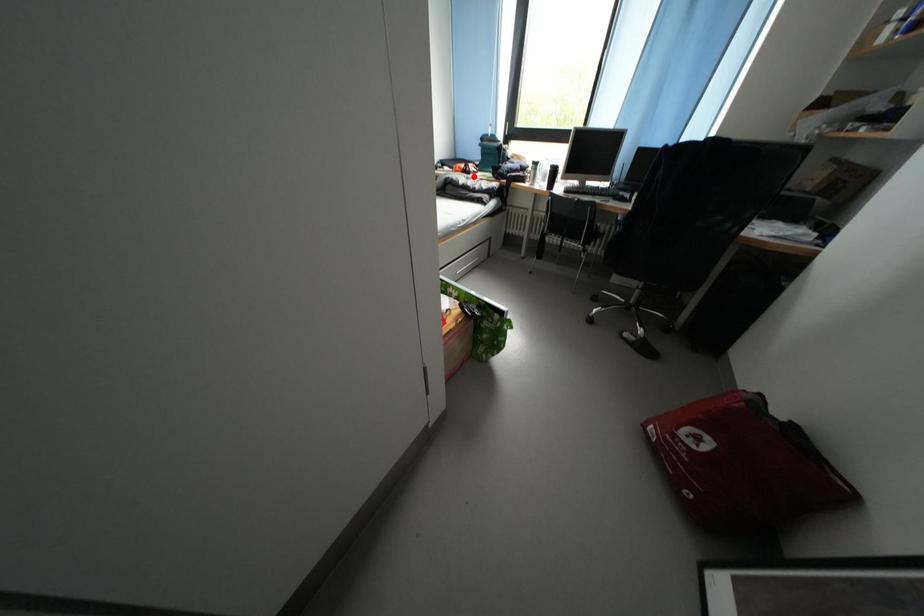
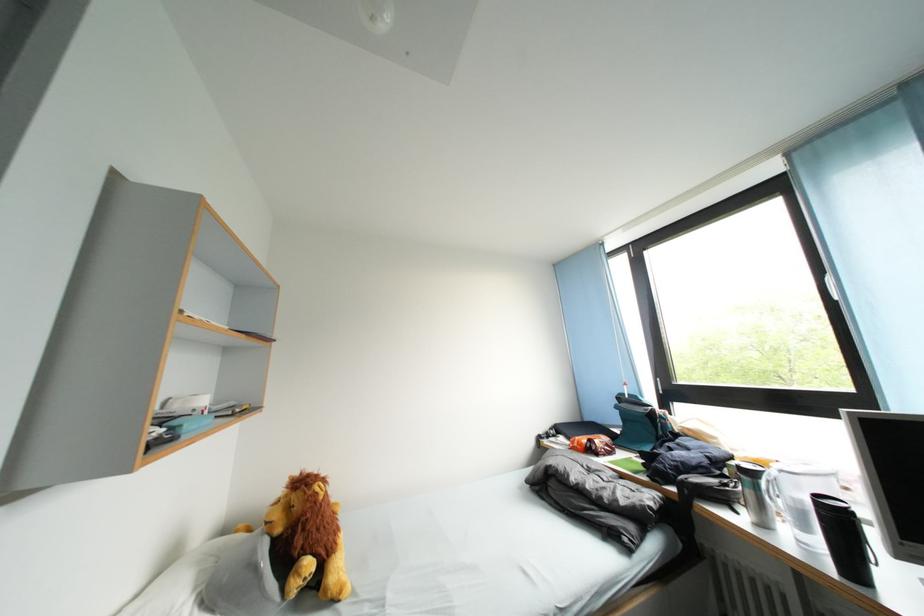
Question: A red point is marked in image1. In image2, is the corresponding 3D point closer to the camera or farther? Reply with the corresponding letter.

Choices:
 (A) The corresponding 3D point is closer.
 (B) The corresponding 3D point is farther.

Answer: (B)